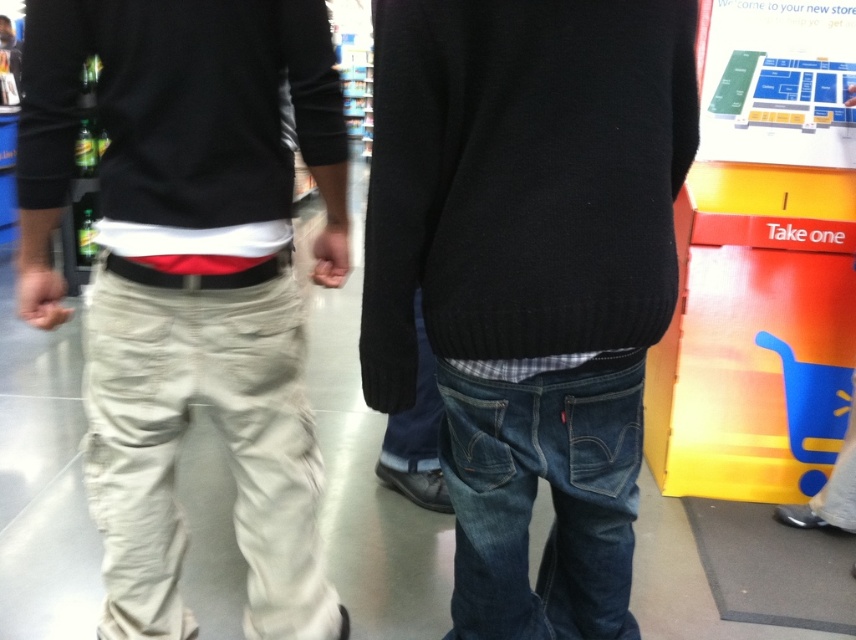
Question: Which point is farther to the camera?

Choices:
 (A) (274, 177)
 (B) (235, 80)
 (C) (403, 312)

Answer: (A)

Question: Does denim jeans at center come behind khaki cotton pants at left?

Choices:
 (A) yes
 (B) no

Answer: (B)

Question: In this image, where is khaki cotton pants at left located relative to black leather sweatshirt at left?

Choices:
 (A) left
 (B) right

Answer: (A)

Question: Which object is closer to the camera taking this photo?

Choices:
 (A) denim jeans at center
 (B) black leather sweatshirt at left

Answer: (A)

Question: Is khaki cotton pants at left wider than black leather sweatshirt at left?

Choices:
 (A) no
 (B) yes

Answer: (B)

Question: Which of the following is the farthest from the observer?

Choices:
 (A) denim jeans at center
 (B) black leather sweatshirt at left
 (C) khaki cotton pants at left

Answer: (C)